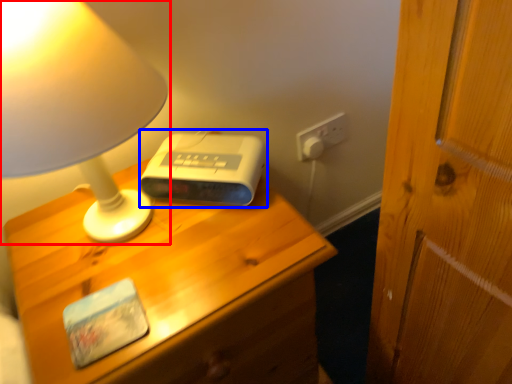
Question: Among these objects, which one is nearest to the camera, lamp (highlighted by a red box) or gadget (highlighted by a blue box)?

Choices:
 (A) lamp
 (B) gadget

Answer: (A)